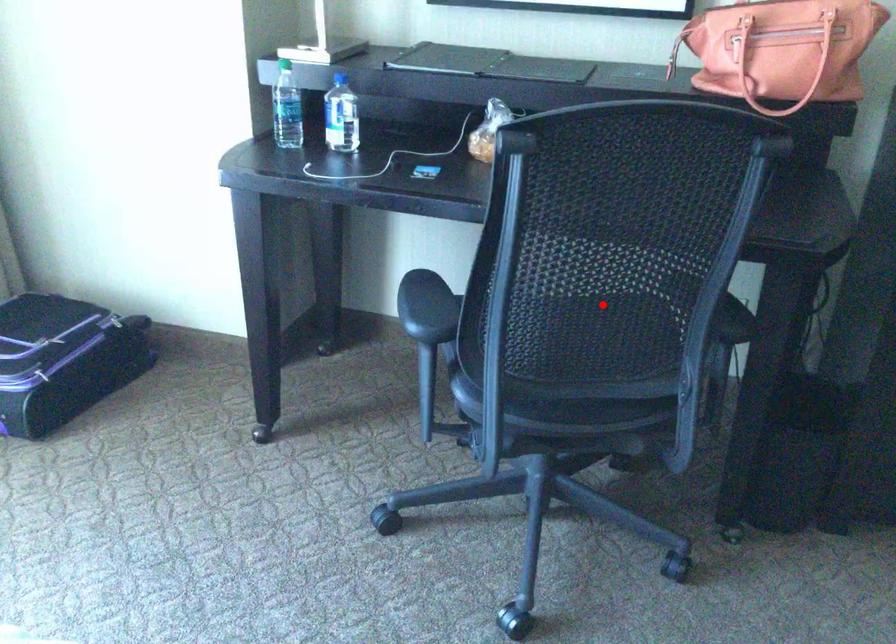
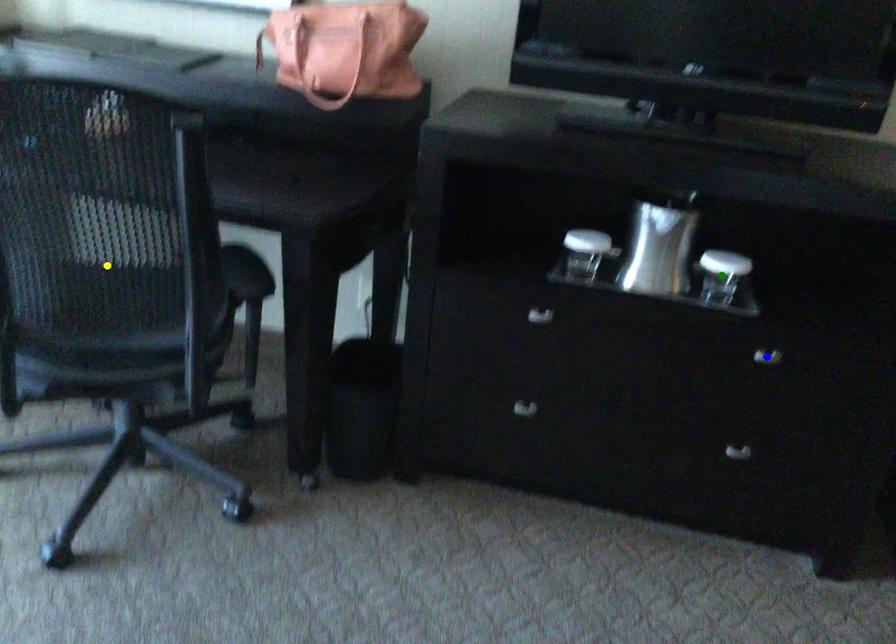
Question: I am providing you with two images of the same scene from different viewpoints. A red point is marked on the first image. You are given multiple points on the second image. Which point in image 2 represents the same 3d spot as the red point in image 1?

Choices:
 (A) green point
 (B) blue point
 (C) yellow point

Answer: (C)